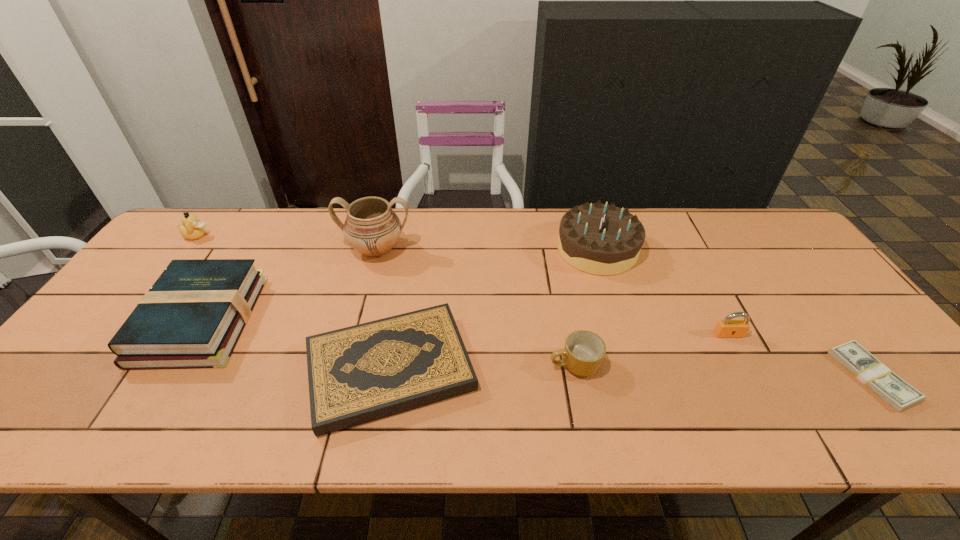
Identify the location of dollar. (897, 393).

This screenshot has width=960, height=540. I want to click on vacant space located 0.200m on the front-facing side of the tallest object, so click(358, 319).

What are the coordinates of `free region located on the front-facing side of the birthday cake` in the screenshot? It's located at (502, 249).

This screenshot has height=540, width=960. Find the location of `free space located 0.360m on the front-facing side of the birthday cake`. free space located 0.360m on the front-facing side of the birthday cake is located at coordinates (440, 249).

Locate an element on the screen. The width and height of the screenshot is (960, 540). free point located 0.050m on the front-facing side of the birthday cake is located at coordinates (540, 249).

What are the coordinates of `blank area located on the face of the leftmost object` in the screenshot? It's located at (337, 236).

Find the location of a particular element. This screenshot has height=540, width=960. free space located 0.130m on the front of the taller hardback book is located at coordinates (139, 422).

This screenshot has width=960, height=540. Identify the location of vacant space located to unlock the padlock from the front. (782, 436).

Where is `vacant region located on the side with the handle of the mug`? vacant region located on the side with the handle of the mug is located at coordinates (476, 364).

Where is `free space located on the side with the handle of the mug`? The image size is (960, 540). free space located on the side with the handle of the mug is located at coordinates pos(506,364).